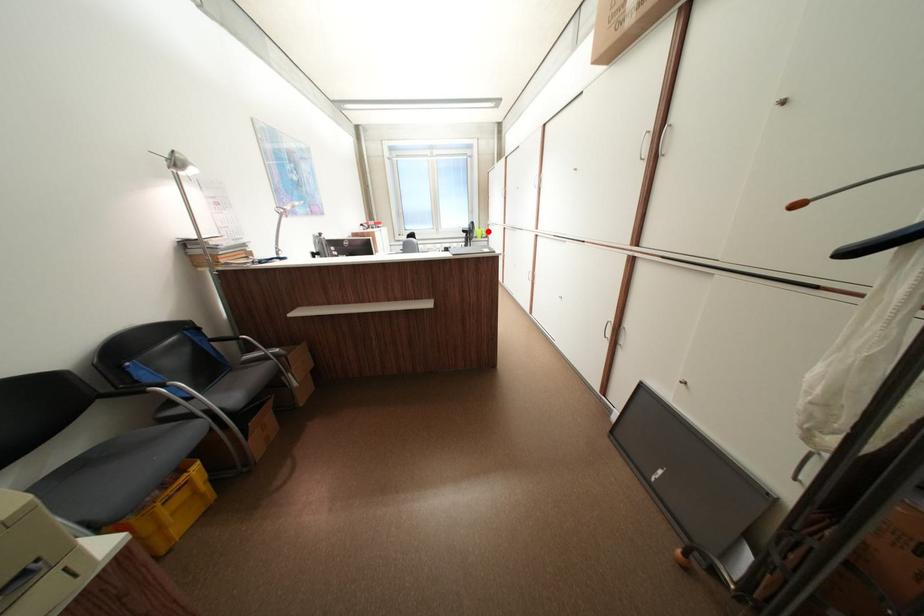
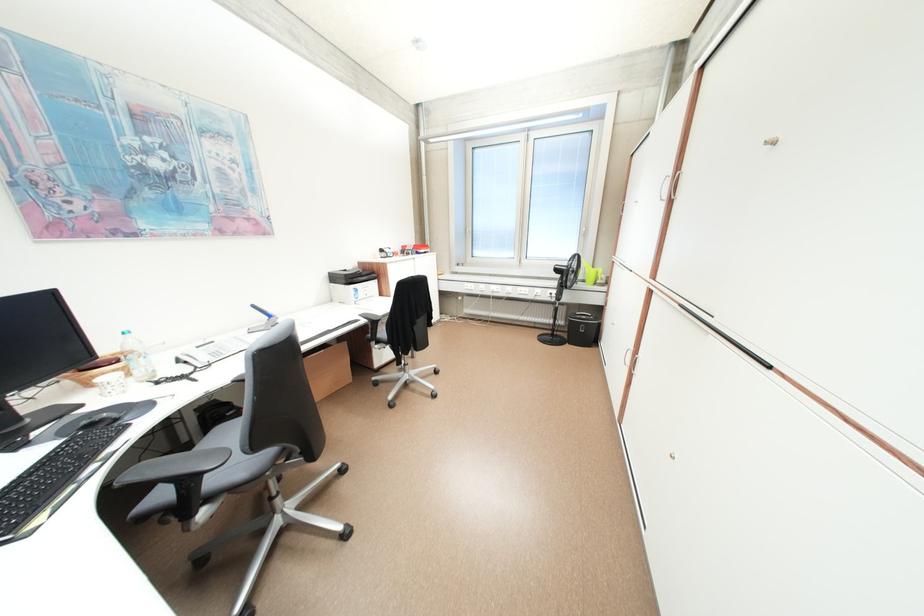
In the second image, find the point that corresponds to the highlighted location in the first image.

(598, 273)